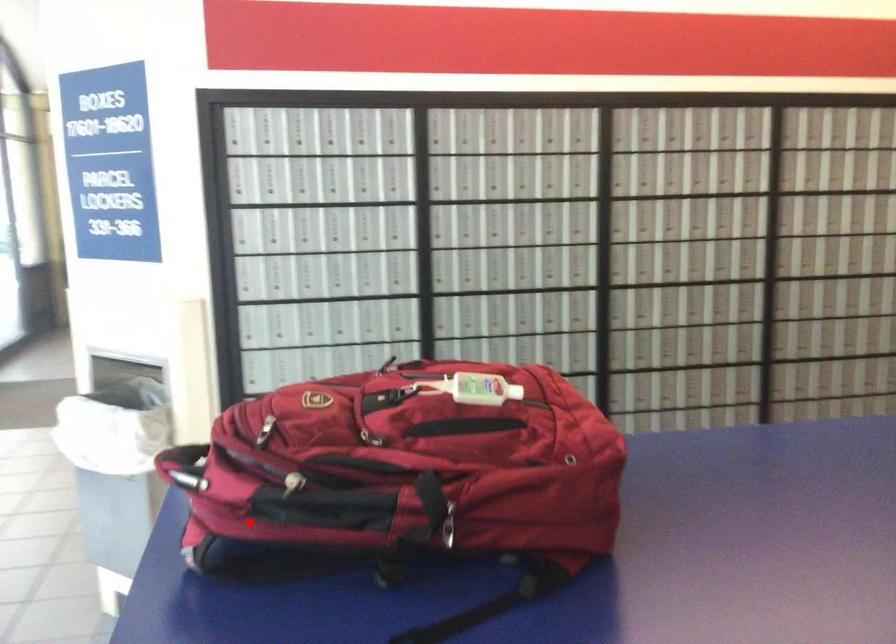
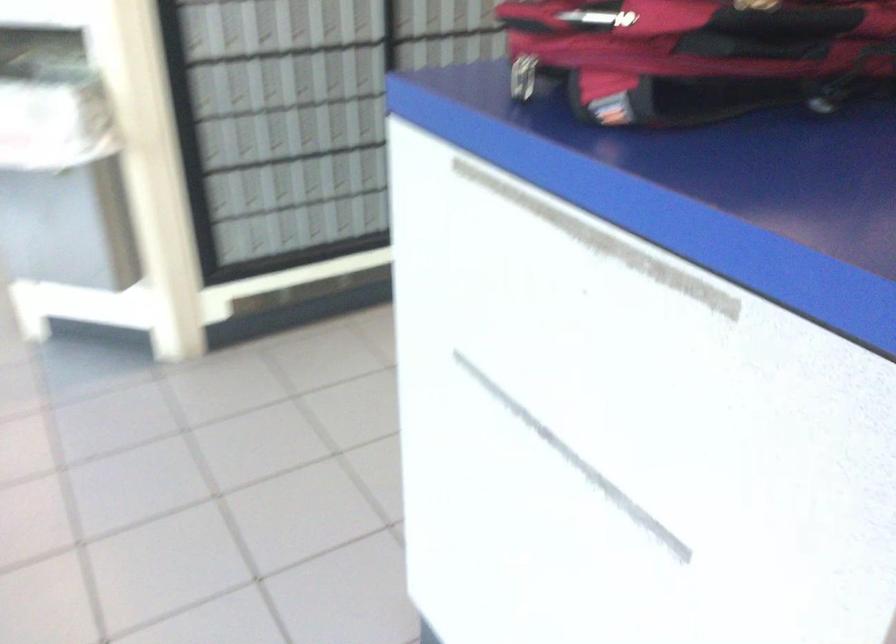
Question: I am providing you with two images of the same scene from different viewpoints. In image1, a red point is highlighted. Considering the same 3D point in image2, which of the following is correct?

Choices:
 (A) It is closer
 (B) It is farther

Answer: (A)